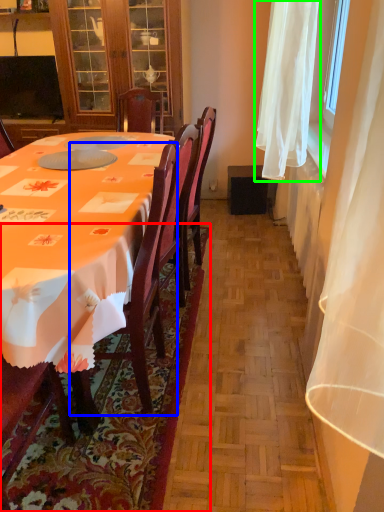
Question: Based on their relative distances, which object is nearer to mat (highlighted by a red box)? Choose from chair (highlighted by a blue box) and curtain (highlighted by a green box).

Choices:
 (A) chair
 (B) curtain

Answer: (A)